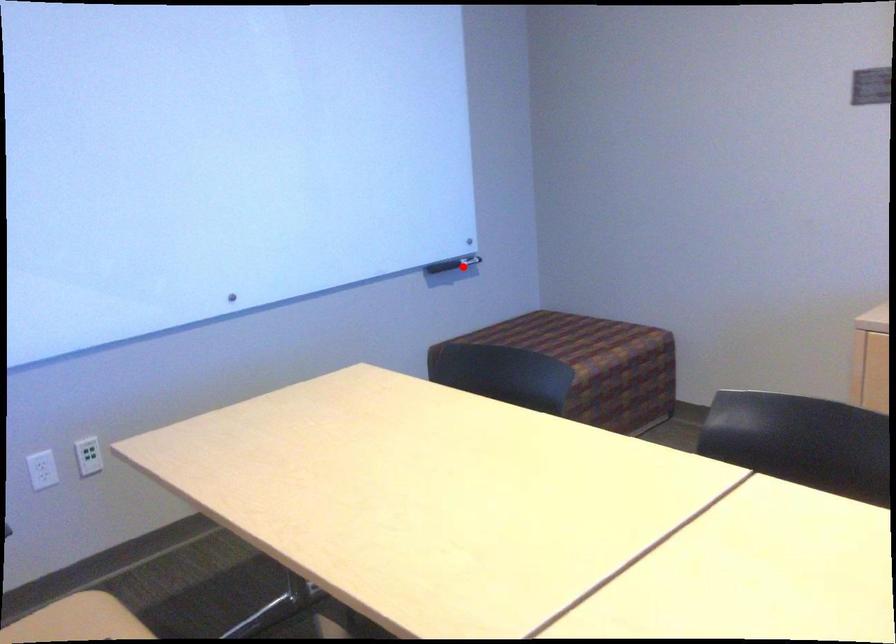
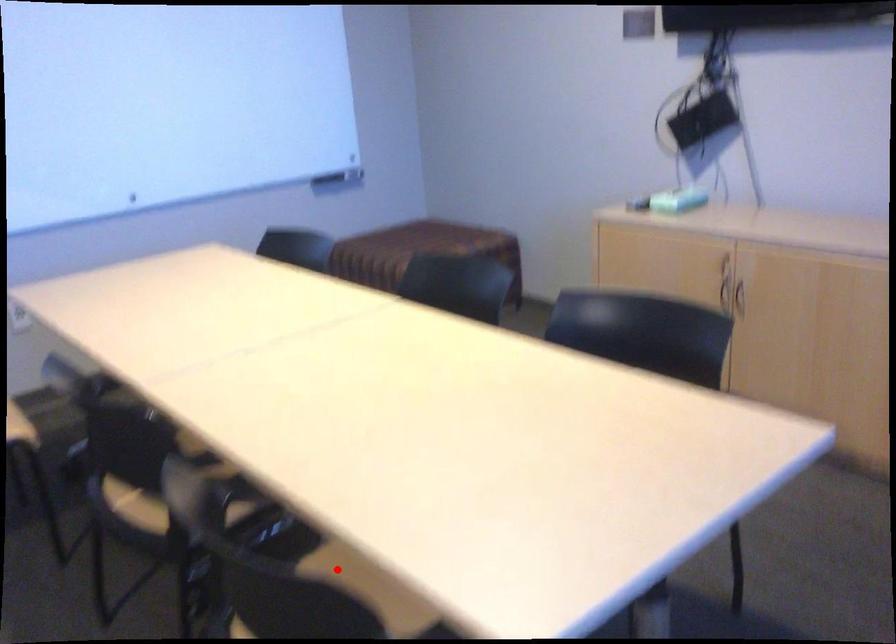
I am providing you with two images of the same scene from different viewpoints. A red point is marked on the first image and another point is marked on the second image. Do the highlighted points in image1 and image2 indicate the same real-world spot?

No